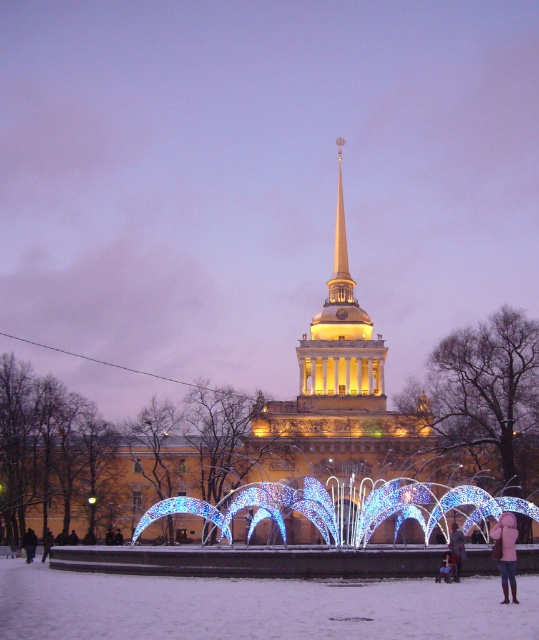
You are standing at the entrance of the building and want to take a photo of the gold polished spire at center. The camera you are using has a maximum focus range of 150 meters. Will the camera be able to focus on the spire?

The distance between the gold polished spire at center and the camera is 158.83 meters, which exceeds the camera maximum focus range of 150 meters. Therefore, the camera will not be able to focus on the spire.

You are standing in front of the building and want to take a photo that includes both the spire and the fountain. The camera can only focus on objects at a specific distance. Which point, point (344, 273) or point (500, 548), is closer to you and should be prioritized for focus?

Point (344, 273) is closer to you than point (500, 548), so prioritize focusing on that point to ensure the spire and fountain are in focus.

You are a delivery person standing at the light pink woolen coat at lower right position. You need to deliver a package to the gold polished spire at center. The delivery robot can carry packages up to 50 meters. Can the robot deliver the package from your current position to the spire?

The gold polished spire at center is 51.41 meters from the light pink woolen coat at lower right. Since the distance exceeds the robot maximum carrying distance of 50 meters, the robot cannot deliver the package from the light pink woolen coat at lower right to the gold polished spire at center.